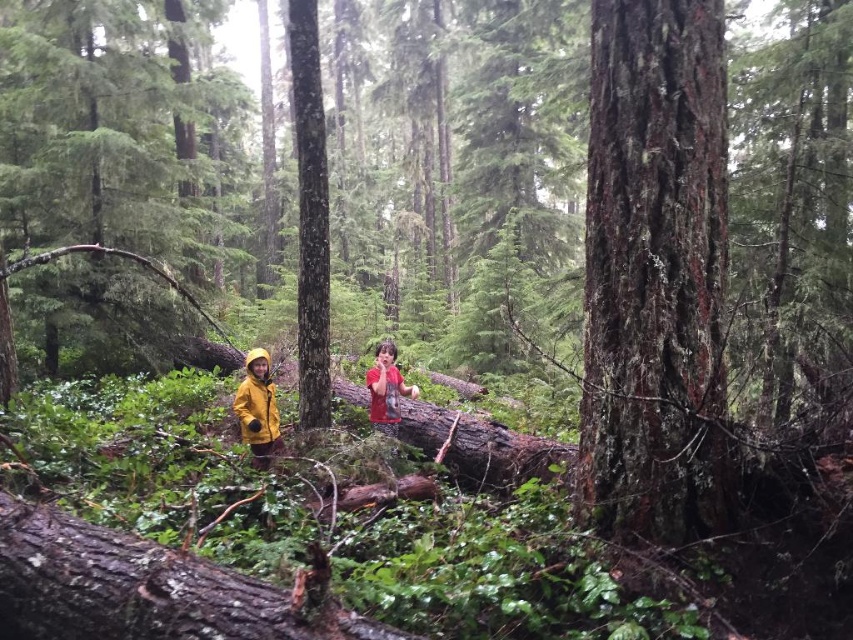
You are a hiker trying to locate your friend who is wearing a red matte shirt at center. You see a smooth dark brown tree trunk at center in the same area. Which object is located to the right of your friend?

The smooth dark brown tree trunk at center is positioned on the right side of red matte shirt at center, so it is to the right of your friend.

You are a hiker who has just entered the forest and sees the smooth dark brown tree trunk at center and the red matte shirt at center. Which object is closer to you?

The smooth dark brown tree trunk at center is closer to you because it is in front of the red matte shirt at center.

You are planning to take a photo of the smooth dark brown tree trunk at center and the yellow matte raincoat at lower left. Which object should you focus on first if you want both to be in sharp focus, considering their sizes?

The smooth dark brown tree trunk at center is bigger than the yellow matte raincoat at lower left, so you should focus on the smooth dark brown tree trunk at center first to ensure both are in sharp focus.